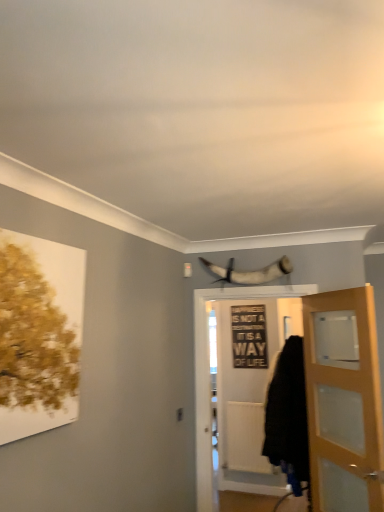
The image size is (384, 512). What are the coordinates of `white wooden door at center, positioned as the 2th door in right-to-left order` in the screenshot? It's located at (209, 372).

Locate an element on the screen. light brown wooden door at right, the 1th door from the right is located at coordinates (343, 401).

What do you see at coordinates (288, 412) in the screenshot?
I see `black fabric cloak at lower right` at bounding box center [288, 412].

This screenshot has height=512, width=384. Find the location of `white wooden door at center, acting as the first door starting from the left`. white wooden door at center, acting as the first door starting from the left is located at coordinates (209, 372).

Does black fabric cloak at lower right have a greater height compared to black matte sign at center?

Yes.

Are black fabric cloak at lower right and black matte sign at center located far from each other?

Yes, black fabric cloak at lower right is far from black matte sign at center.

Is black fabric cloak at lower right wider than black matte sign at center?

Correct, the width of black fabric cloak at lower right exceeds that of black matte sign at center.

Considering the relative sizes of black matte sign at center and shiny silver horn at upper center in the image provided, is black matte sign at center wider than shiny silver horn at upper center?

No, black matte sign at center is not wider than shiny silver horn at upper center.

From the image's perspective, which is above, black matte sign at center or shiny silver horn at upper center?

shiny silver horn at upper center appears higher in the image.

From a real-world perspective, which object rests below the other?

black matte sign at center, from a real-world perspective.

At what (x,y) coordinates should I click in order to perform the action: click on picture frame below the shiny silver horn at upper center (from the image's perspective). Please return your answer as a coordinate pair (x, y). This screenshot has height=512, width=384. Looking at the image, I should click on point(249,336).

Considering the positions of points (272, 452) and (233, 272), is point (272, 452) farther from camera compared to point (233, 272)?

That is True.

Identify the location of cloak below the shiny silver horn at upper center (from a real-world perspective). The image size is (384, 512). (288, 412).

Is black fabric cloak at lower right positioned with its back to shiny silver horn at upper center?

No, black fabric cloak at lower right's orientation is not away from shiny silver horn at upper center.

Is black fabric cloak at lower right to the right of shiny silver horn at upper center from the viewer's perspective?

Yes, black fabric cloak at lower right is to the right of shiny silver horn at upper center.

In terms of height, does white wooden door at center, positioned as the 2th door in right-to-left order, look taller or shorter compared to black fabric cloak at lower right?

white wooden door at center, positioned as the 2th door in right-to-left order, is shorter than black fabric cloak at lower right.

How different are the orientations of white wooden door at center, acting as the first door starting from the left, and black fabric cloak at lower right in degrees?

89.8 degrees separate the facing orientations of white wooden door at center, acting as the first door starting from the left, and black fabric cloak at lower right.

From the image's perspective, is white wooden door at center, positioned as the 2th door in right-to-left order, on black fabric cloak at lower right?

Indeed, from the image's perspective, white wooden door at center, positioned as the 2th door in right-to-left order, is shown above black fabric cloak at lower right.

Where is `door on the left of black fabric cloak at lower right`? Image resolution: width=384 pixels, height=512 pixels. door on the left of black fabric cloak at lower right is located at coordinates (209, 372).

From the image's perspective, count 1st doors upward from the black fabric cloak at lower right and point to it. Please provide its 2D coordinates.

[(209, 372)]

In the scene shown: Between black fabric cloak at lower right and white wooden door at center, acting as the first door starting from the left, which one has larger width?

black fabric cloak at lower right.

Considering the sizes of black fabric cloak at lower right and white wooden door at center, positioned as the 2th door in right-to-left order, in the image, is black fabric cloak at lower right taller or shorter than white wooden door at center, positioned as the 2th door in right-to-left order,?

In the image, black fabric cloak at lower right appears to be taller than white wooden door at center, positioned as the 2th door in right-to-left order.

Visually, is white wooden door at center, acting as the first door starting from the left, positioned to the left or to the right of shiny silver horn at upper center?

In the image, white wooden door at center, acting as the first door starting from the left, appears on the right side of shiny silver horn at upper center.

Is white wooden door at center, acting as the first door starting from the left, positioned in front of shiny silver horn at upper center?

Yes, it is in front of shiny silver horn at upper center.

From the image's perspective, does white wooden door at center, acting as the first door starting from the left, appear higher than shiny silver horn at upper center?

Incorrect, from the image's perspective, white wooden door at center, acting as the first door starting from the left, is lower than shiny silver horn at upper center.

Based on their sizes in the image, would you say white wooden door at center, positioned as the 2th door in right-to-left order, is bigger or smaller than shiny silver horn at upper center?

Considering their sizes, white wooden door at center, positioned as the 2th door in right-to-left order, takes up more space than shiny silver horn at upper center.

Can you confirm if black matte sign at center is shorter than white wooden door at center, positioned as the 2th door in right-to-left order?

Indeed, black matte sign at center has a lesser height compared to white wooden door at center, positioned as the 2th door in right-to-left order.

Which object is further away from the camera, black matte sign at center or white wooden door at center, acting as the first door starting from the left?

black matte sign at center is more distant.

You are a GUI agent. You are given a task and a screenshot of the screen. Output one action in this format:
    pyautogui.click(x=<x>, y=<y>)
    Task: Click on the picture frame above the white wooden door at center, positioned as the 2th door in right-to-left order (from the image's perspective)
    The width and height of the screenshot is (384, 512).
    Given the screenshot: What is the action you would take?
    pyautogui.click(x=249, y=336)

From a real-world perspective, relative to white wooden door at center, positioned as the 2th door in right-to-left order, is black matte sign at center vertically above or below?

In terms of real-world spatial position, black matte sign at center is above white wooden door at center, positioned as the 2th door in right-to-left order.

At what (x,y) coordinates should I click in order to perform the action: click on picture frame behind the black fabric cloak at lower right. Please return your answer as a coordinate pair (x, y). This screenshot has width=384, height=512. Looking at the image, I should click on (249, 336).

Locate an element on the screen. The height and width of the screenshot is (512, 384). animal above the black matte sign at center (from a real-world perspective) is located at coordinates (250, 272).

From the image, which object appears to be nearer to light brown wooden door at right, the 1th door from the right, white wooden door at center, acting as the first door starting from the left, or shiny silver horn at upper center?

The object closer to light brown wooden door at right, the 1th door from the right, is white wooden door at center, acting as the first door starting from the left.

From the image, which object appears to be nearer to shiny silver horn at upper center, black fabric cloak at lower right or white wooden door at center, positioned as the 2th door in right-to-left order?

Based on the image, white wooden door at center, positioned as the 2th door in right-to-left order, appears to be nearer to shiny silver horn at upper center.

Which object lies further to the anchor point light brown wooden door at right, the 1th door from the right, black matte sign at center or black fabric cloak at lower right?

Based on the image, black matte sign at center appears to be further to light brown wooden door at right, the 1th door from the right.

In the scene shown: Estimate the real-world distances between objects in this image. Which object is closer to black fabric cloak at lower right, light brown wooden door at right, which ranks as the 2th door in left-to-right order, or white wooden door at center, positioned as the 2th door in right-to-left order?

white wooden door at center, positioned as the 2th door in right-to-left order, is closer to black fabric cloak at lower right.

From the image, which object appears to be nearer to white wooden door at center, acting as the first door starting from the left, black matte sign at center or black fabric cloak at lower right?

black fabric cloak at lower right is closer to white wooden door at center, acting as the first door starting from the left.

Looking at the image, which one is located further to light brown wooden door at right, which ranks as the 2th door in left-to-right order, shiny silver horn at upper center or black fabric cloak at lower right?

shiny silver horn at upper center is positioned further to the anchor light brown wooden door at right, which ranks as the 2th door in left-to-right order.

Looking at the image, which one is located further to black fabric cloak at lower right, shiny silver horn at upper center or black matte sign at center?

black matte sign at center is positioned further to the anchor black fabric cloak at lower right.

Looking at the image, which one is located closer to black matte sign at center, light brown wooden door at right, the 1th door from the right, or black fabric cloak at lower right?

black fabric cloak at lower right lies closer to black matte sign at center than the other object.

Where is `door located between light brown wooden door at right, the 1th door from the right, and black matte sign at center in the depth direction`? Image resolution: width=384 pixels, height=512 pixels. door located between light brown wooden door at right, the 1th door from the right, and black matte sign at center in the depth direction is located at coordinates (209, 372).

At what (x,y) coordinates should I click in order to perform the action: click on animal between light brown wooden door at right, the 1th door from the right, and black matte sign at center, along the z-axis. Please return your answer as a coordinate pair (x, y). This screenshot has height=512, width=384. Looking at the image, I should click on (250, 272).

At what (x,y) coordinates should I click in order to perform the action: click on cloak between shiny silver horn at upper center and black matte sign at center along the z-axis. Please return your answer as a coordinate pair (x, y). This screenshot has height=512, width=384. Looking at the image, I should click on (288, 412).

In order to click on door between light brown wooden door at right, the 1th door from the right, and black fabric cloak at lower right in the front-back direction in this screenshot , I will do `click(209, 372)`.